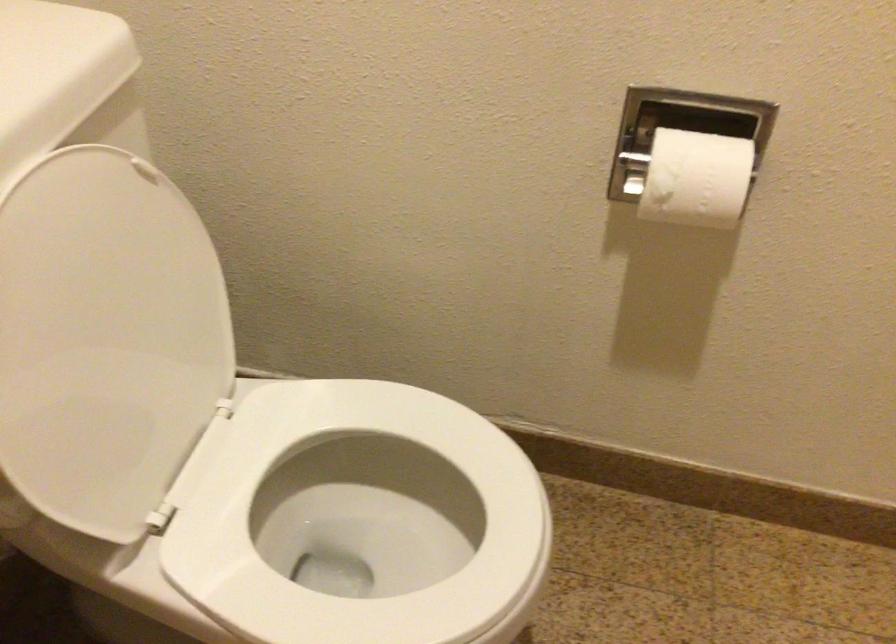
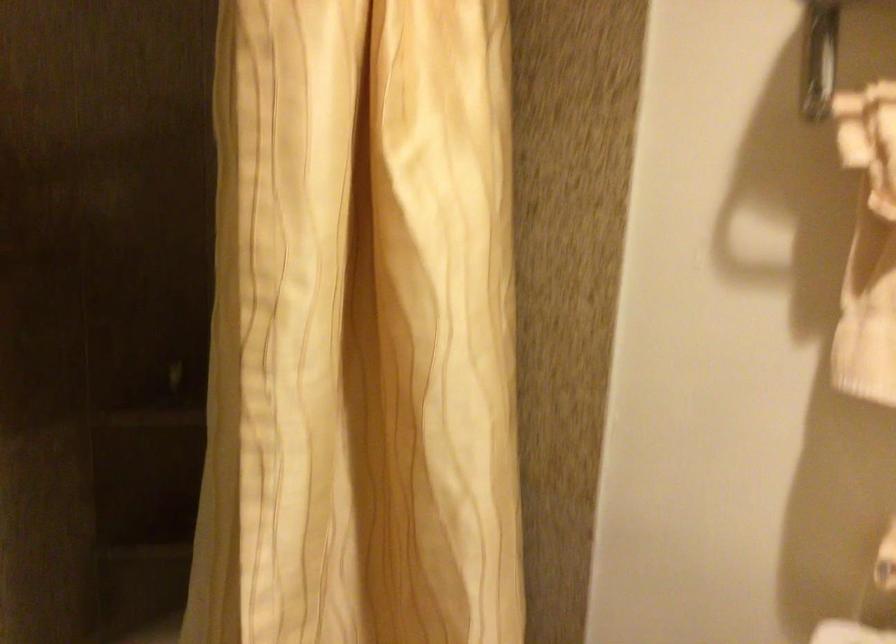
Based on the continuous images, in which direction is the camera rotating?

The camera's rotation is toward left-down.